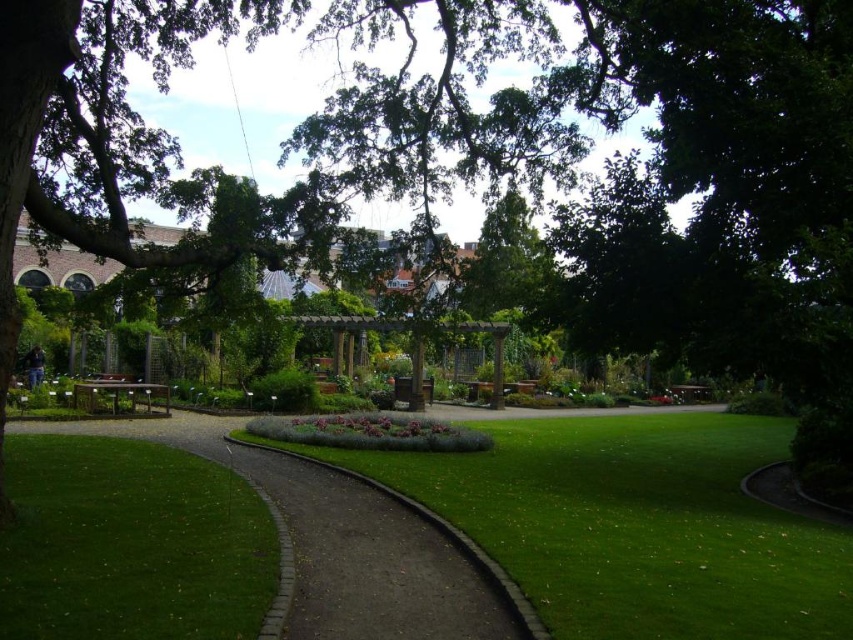
Question: Is green grass at lower left above brown brick path at center?

Choices:
 (A) no
 (B) yes

Answer: (B)

Question: Does green grass at lower left appear on the left side of brown brick path at center?

Choices:
 (A) yes
 (B) no

Answer: (A)

Question: Which point appears closest to the camera in this image?

Choices:
 (A) (410, 513)
 (B) (10, 570)

Answer: (B)

Question: Is the position of green grass at lower left less distant than that of brown brick path at center?

Choices:
 (A) yes
 (B) no

Answer: (A)